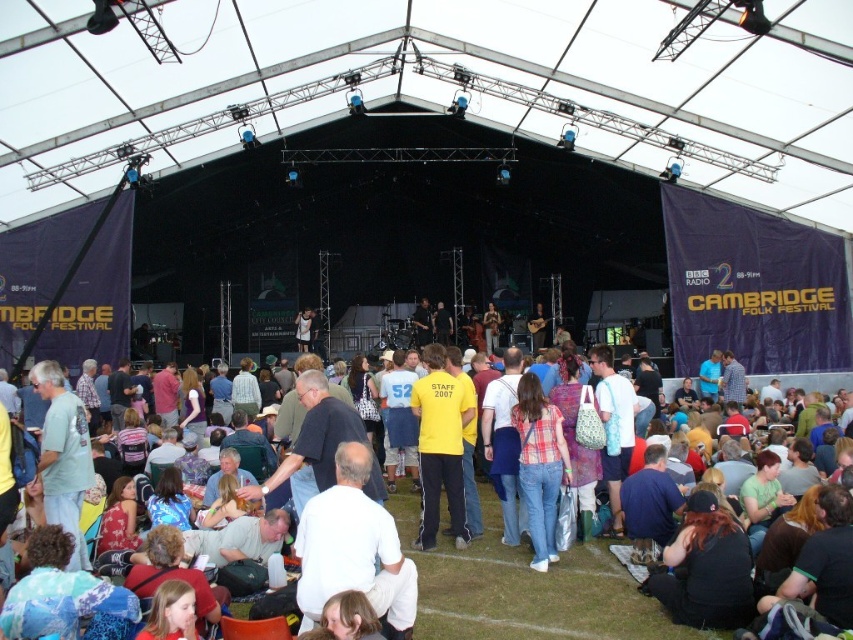
Does yellow cotton t-shirt at center have a lesser height compared to plaid shirt at center?

Indeed, yellow cotton t-shirt at center has a lesser height compared to plaid shirt at center.

Is point (502, 593) closer to viewer compared to point (547, 422)?

Yes, it is in front of point (547, 422).

I want to click on yellow cotton t-shirt at center, so click(527, 593).

This screenshot has height=640, width=853. What do you see at coordinates (440, 445) in the screenshot?
I see `yellow cotton shirt at center` at bounding box center [440, 445].

Is point (427, 547) behind point (297, 348)?

No, it is in front of (297, 348).

Find the location of a particular element. yellow cotton shirt at center is located at coordinates (440, 445).

Is point (556, 502) behind point (300, 330)?

No, (556, 502) is in front of (300, 330).

Which is above, plaid shirt at center or matte yellow t-shirt at center?

matte yellow t-shirt at center is above.

Image resolution: width=853 pixels, height=640 pixels. Identify the location of plaid shirt at center. (540, 465).